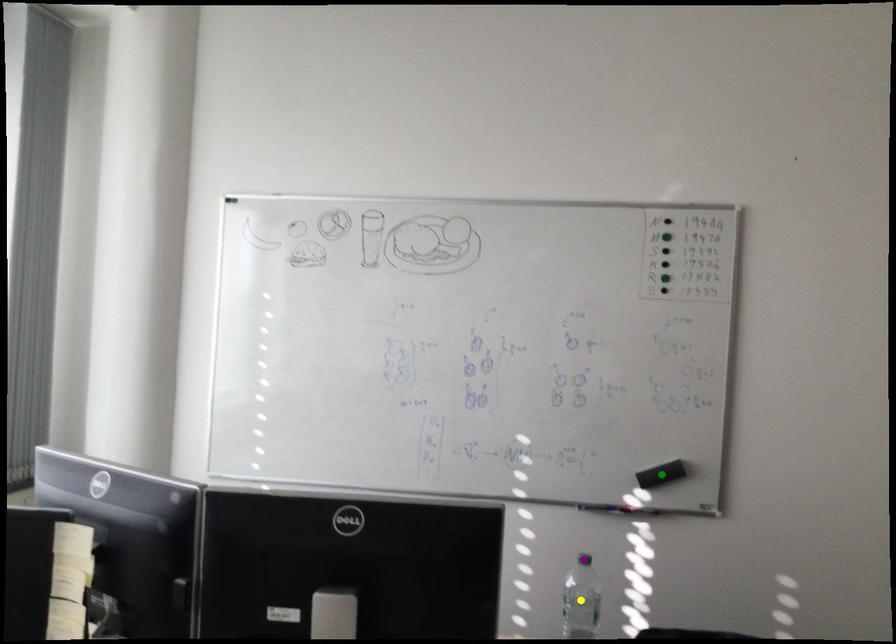
Order these from nearest to farthest:
A) yellow point
B) purple point
C) green point

1. yellow point
2. green point
3. purple point